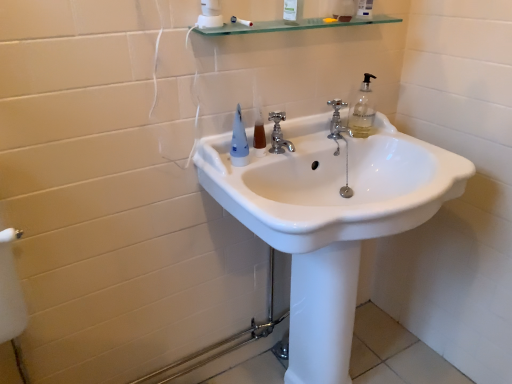
I want to click on blank space above transparent glass shelf at upper center (from a real-world perspective), so click(303, 26).